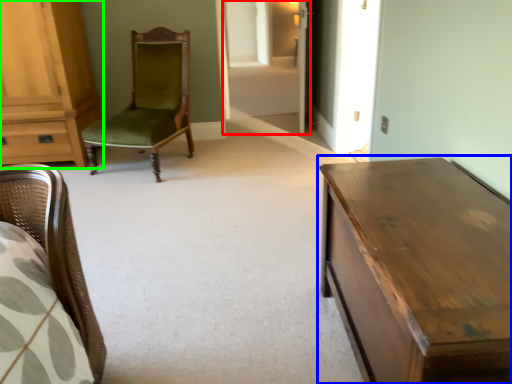
Question: Which is nearer to the glass door (highlighted by a red box)? table (highlighted by a blue box) or cabinetry (highlighted by a green box).

Choices:
 (A) table
 (B) cabinetry

Answer: (B)